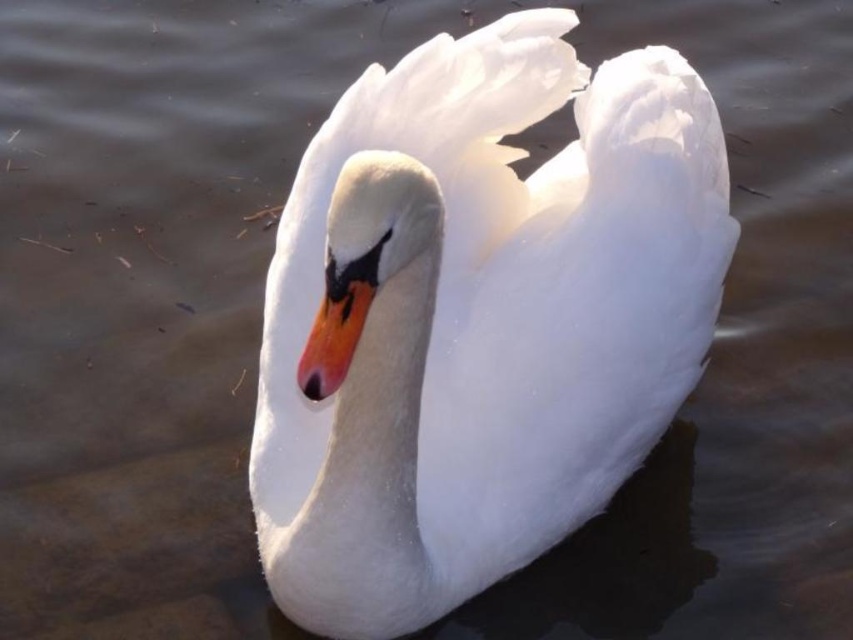
You are a birdwatcher observing a swan in a lake. You notice the white glossy swan at center and the orange glossy beak at center. Which object is taller?

The white glossy swan at center is much taller than the orange glossy beak at center.

You are a wildlife photographer trying to capture a closeup shot of the orange glossy beak at center while keeping the white glossy swan at center in the frame. Based on their distance, can you estimate if the camera lens can focus on both objects simultaneously?

The white glossy swan at center and orange glossy beak at center are 23.47 inches apart from each other. Depending on the lens depth of field, if the camera is set to a narrow aperture, it might be possible to have both in focus. However, if the distance is too great for the current settings, the beak might be sharp while the swan appears slightly blurred.